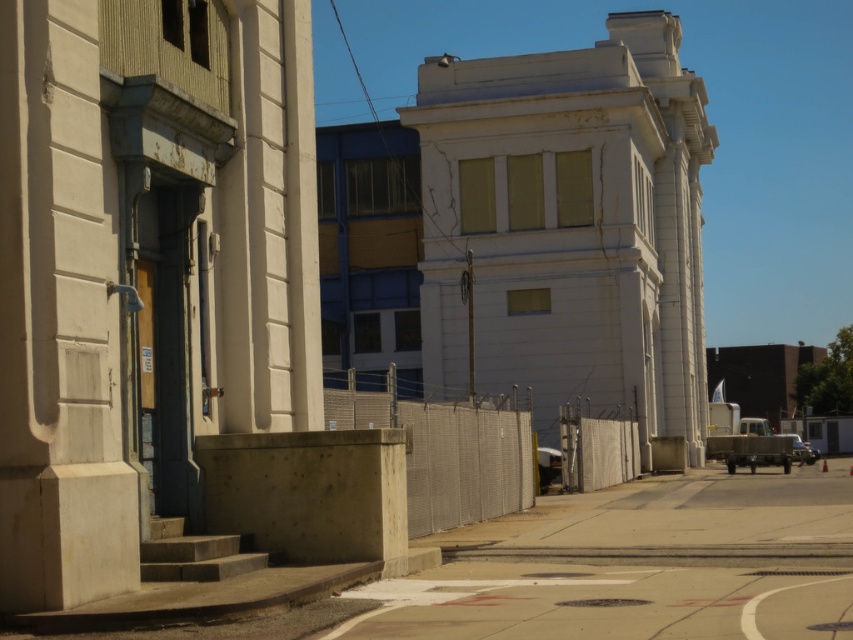
Between point (693, 628) and point (41, 333), which one is positioned in front?

Point (693, 628) is in front.

Is point (849, 522) positioned after point (15, 243)?

Yes, it is behind point (15, 243).

In order to click on concrete pavement at center in this screenshot , I will do `click(640, 564)`.